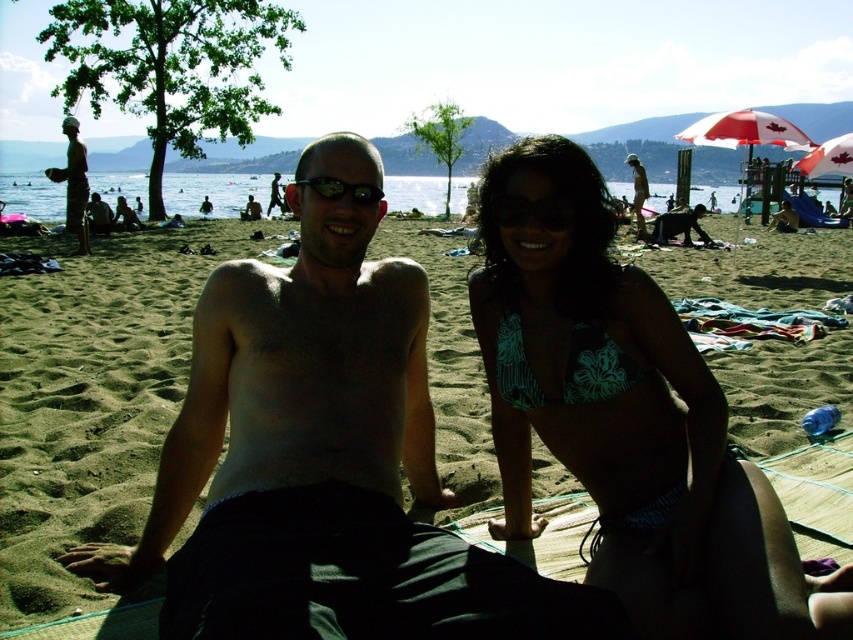
Question: Estimate the real-world distances between objects in this image. Which object is closer to the matte bronze statue at left?

Choices:
 (A) matte black pants at center
 (B) light brown wooden surfboard at center
 (C) green matte goggles at center

Answer: (A)

Question: Does matte black pants at center lie behind green matte goggles at center?

Choices:
 (A) no
 (B) yes

Answer: (B)

Question: Is matte bronze statue at left positioned before white fabric umbrella at upper right?

Choices:
 (A) no
 (B) yes

Answer: (A)

Question: Which point appears closest to the camera in this image?

Choices:
 (A) (589, 401)
 (B) (787, 428)
 (C) (848, 163)
 (D) (318, 189)

Answer: (D)

Question: Is white fabric umbrella at upper right to the right of black plastic sunglasses at center from the viewer's perspective?

Choices:
 (A) no
 (B) yes

Answer: (B)

Question: Which point appears farthest from the camera in this image?

Choices:
 (A) (512, 310)
 (B) (289, 186)
 (C) (746, 122)

Answer: (C)